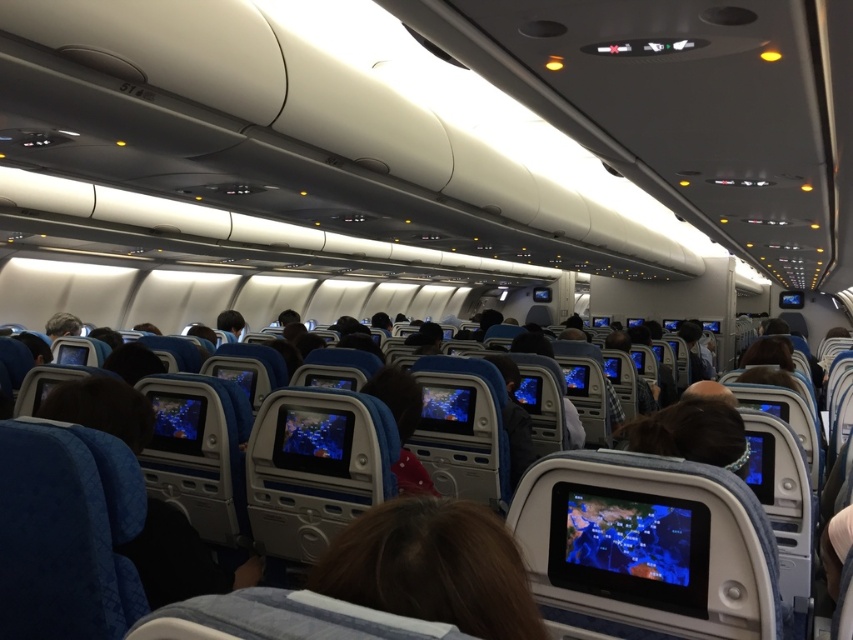
Does brown hair at center appear under blue glossy screen at center?

Incorrect, brown hair at center is not positioned below blue glossy screen at center.

Which is more to the right, brown hair at center or blue glossy screen at center?

blue glossy screen at center is more to the right.

Locate an element on the screen. brown hair at center is located at coordinates (432, 566).